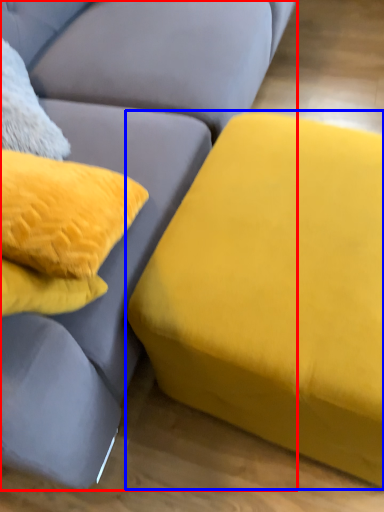
Question: Which of the following is the farthest to the observer, studio couch (highlighted by a red box) or studio couch (highlighted by a blue box)?

Choices:
 (A) studio couch
 (B) studio couch

Answer: (B)